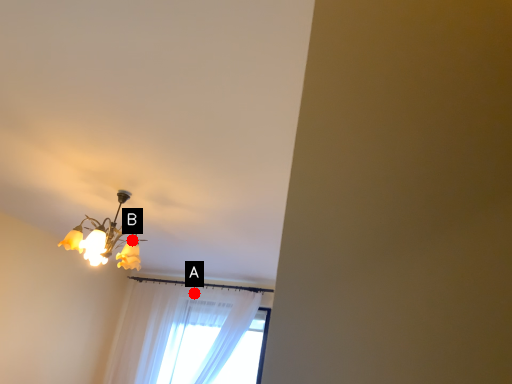
Question: Two points are circled on the image, labeled by A and B beside each circle. Which of the following is the closest to the observer?

Choices:
 (A) A is closer
 (B) B is closer

Answer: (B)